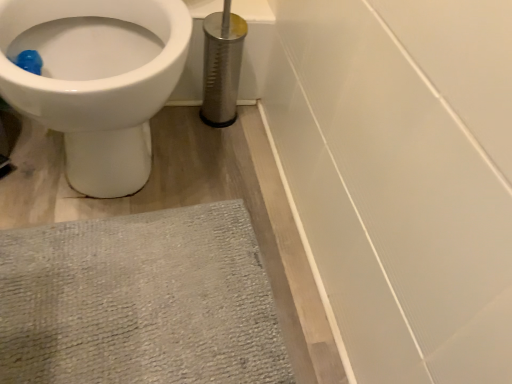
Where is `empty space that is ontop of gray textured bath mat at lower left`? This screenshot has width=512, height=384. empty space that is ontop of gray textured bath mat at lower left is located at coordinates [122, 312].